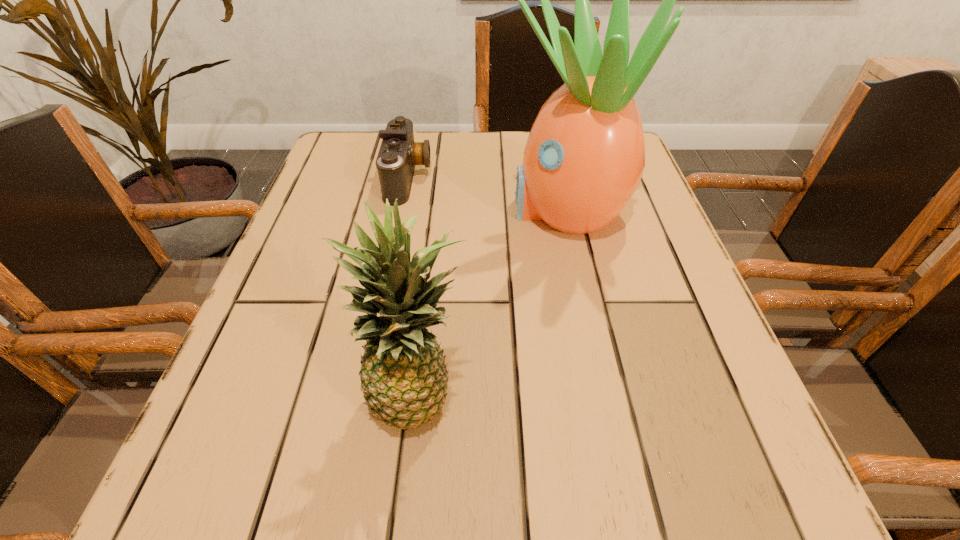
This screenshot has height=540, width=960. I want to click on the rightmost object, so click(x=584, y=158).

At what (x,y) coordinates should I click in order to perform the action: click on the farther pineapple. Please return your answer as a coordinate pair (x, y). Image resolution: width=960 pixels, height=540 pixels. Looking at the image, I should click on click(x=584, y=158).

Find the location of a particular element. the nearest object is located at coordinates (403, 374).

Locate an element on the screen. This screenshot has width=960, height=540. the nearer pineapple is located at coordinates (403, 374).

Where is `the shortest object`? the shortest object is located at coordinates (398, 154).

At what (x,y) coordinates should I click in order to perform the action: click on vacant space situated 0.140m at the entrance of the farther pineapple. Please return your answer as a coordinate pair (x, y). This screenshot has width=960, height=540. Looking at the image, I should click on (439, 209).

The image size is (960, 540). I want to click on vacant space located 0.100m at the entrance of the farther pineapple, so click(458, 209).

This screenshot has width=960, height=540. What are the coordinates of `vacant space located 0.070m at the entrance of the farther pineapple` in the screenshot? It's located at (472, 209).

Image resolution: width=960 pixels, height=540 pixels. I want to click on vacant point located 0.110m on the back of the nearest object, so tap(431, 299).

Image resolution: width=960 pixels, height=540 pixels. Identify the location of vacant space located on the lens of the camera. (563, 177).